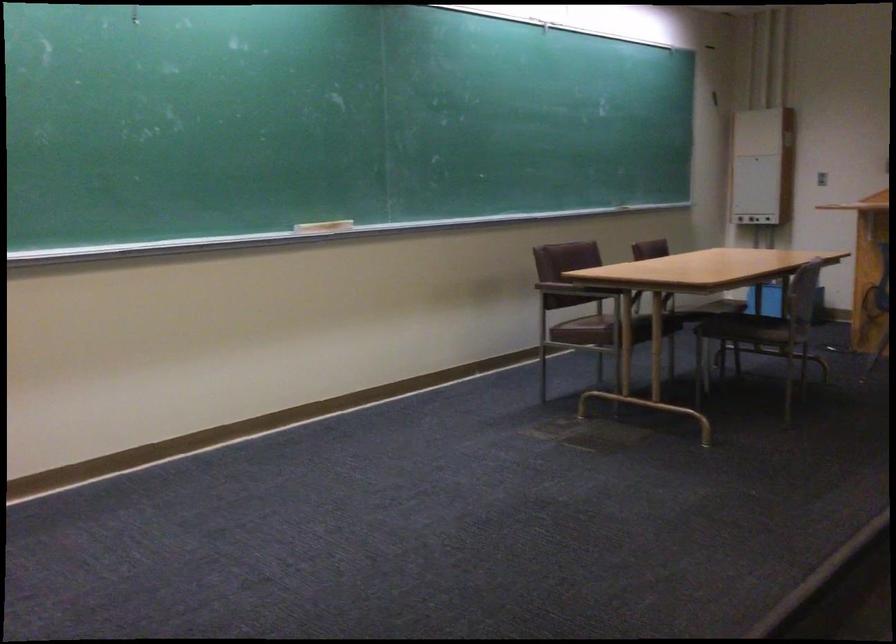
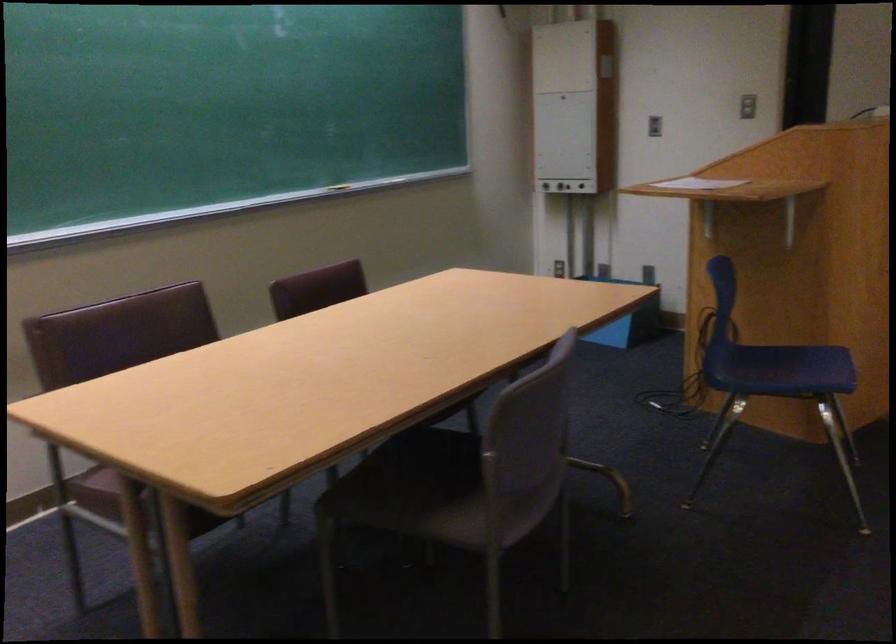
Which direction would the cameraman need to move to produce the second image?

The movement direction of the cameraman is right, forward.